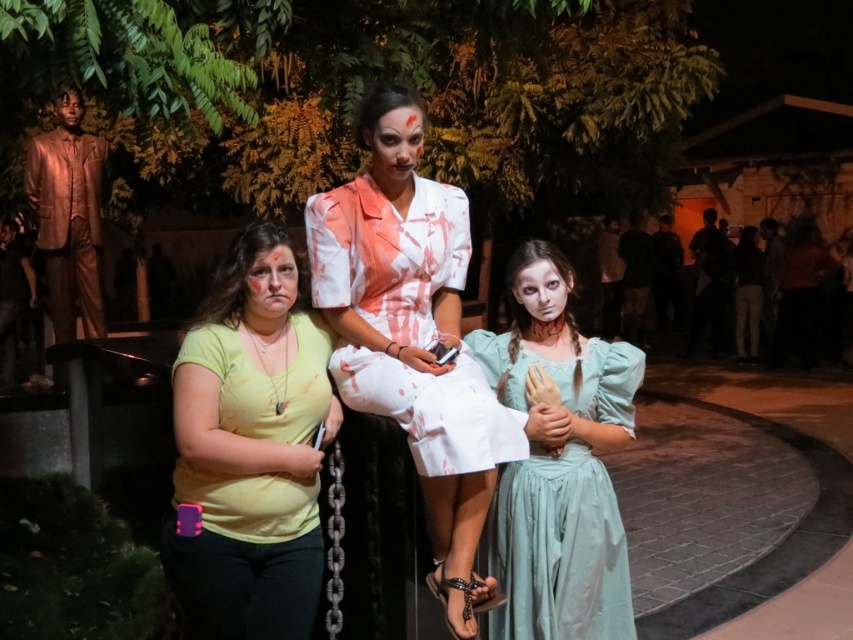
Question: Which object is farther from the camera taking this photo?

Choices:
 (A) white fabric dress at center
 (B) yellow matte shirt at center
 (C) bronze/statue at left
 (D) light blue satin dress at center

Answer: (C)

Question: Which point appears closest to the camera in this image?

Choices:
 (A) (65, 275)
 (B) (509, 500)
 (C) (451, 371)
 (D) (265, 604)

Answer: (D)

Question: Considering the real-world distances, which object is farthest from the bronze/statue at left?

Choices:
 (A) yellow matte shirt at center
 (B) light blue satin dress at center

Answer: (B)

Question: Can you confirm if white fabric dress at center is positioned to the left of yellow matte shirt at center?

Choices:
 (A) no
 (B) yes

Answer: (A)

Question: Is the position of white fabric dress at center less distant than that of bronze/statue at left?

Choices:
 (A) no
 (B) yes

Answer: (B)

Question: Does white fabric dress at center appear on the right side of bronze/statue at left?

Choices:
 (A) yes
 (B) no

Answer: (A)